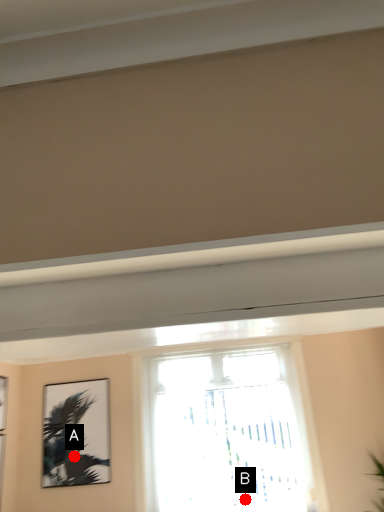
Question: Two points are circled on the image, labeled by A and B beside each circle. Which point is farther from the camera taking this photo?

Choices:
 (A) A is further
 (B) B is further

Answer: (B)